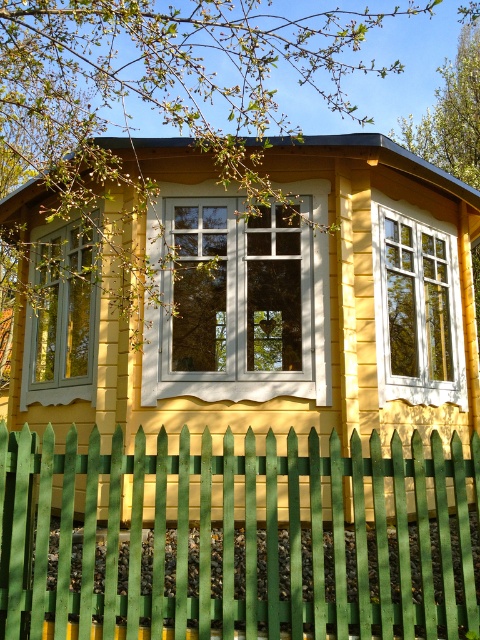
Question: Observing the image, what is the correct spatial positioning of yellow wooden hut at center in reference to white painted wood window at center?

Choices:
 (A) left
 (B) right

Answer: (B)

Question: Is yellow wooden hut at center thinner than matte yellow window at left?

Choices:
 (A) yes
 (B) no

Answer: (B)

Question: Which object is positioned closest to the green wooden fence at lower center?

Choices:
 (A) white painted wood window at center
 (B) matte yellow window at left
 (C) white wood window at center
 (D) yellow wooden hut at center

Answer: (D)

Question: Among these points, which one is nearest to the camera?

Choices:
 (A) (313, 403)
 (B) (43, 355)
 (C) (296, 436)

Answer: (C)

Question: Which object appears farthest from the camera in this image?

Choices:
 (A) white painted wood window at center
 (B) white wood window at center
 (C) matte yellow window at left
 (D) green wooden fence at lower center

Answer: (C)

Question: Considering the relative positions of green wooden fence at lower center and white wood window at center in the image provided, where is green wooden fence at lower center located with respect to white wood window at center?

Choices:
 (A) above
 (B) below

Answer: (B)